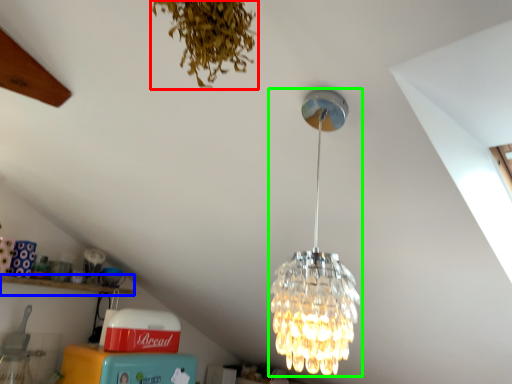
Question: Considering the real-world distances, which object is closest to plant (highlighted by a red box)? shelf (highlighted by a blue box) or lamp (highlighted by a green box).

Choices:
 (A) shelf
 (B) lamp

Answer: (B)